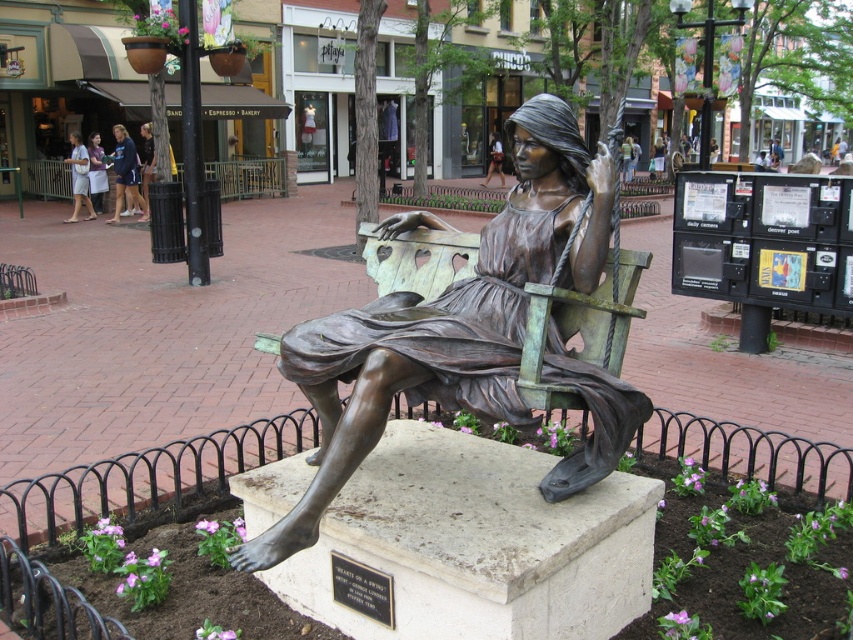
Question: Does blue athletic wear at left appear on the left side of white cotton shorts at left?

Choices:
 (A) no
 (B) yes

Answer: (A)

Question: Can you confirm if white cotton shorts at left is thinner than light brown leather jacket at upper center?

Choices:
 (A) no
 (B) yes

Answer: (A)

Question: Observing the image, what is the correct spatial positioning of bronze statue at center in reference to blue athletic wear at left?

Choices:
 (A) below
 (B) above

Answer: (A)

Question: Among these objects, which one is nearest to the camera?

Choices:
 (A) bronze statue at center
 (B) blue athletic wear at left

Answer: (A)

Question: Based on their relative distances, which object is nearer to the light brown leather jacket at upper center?

Choices:
 (A) white cotton shorts at left
 (B) bronze statue at center
 (C) blue athletic wear at left

Answer: (C)

Question: Estimate the real-world distances between objects in this image. Which object is closer to the bronze statue at center?

Choices:
 (A) light brown leather jacket at upper center
 (B) white cotton shorts at left

Answer: (B)